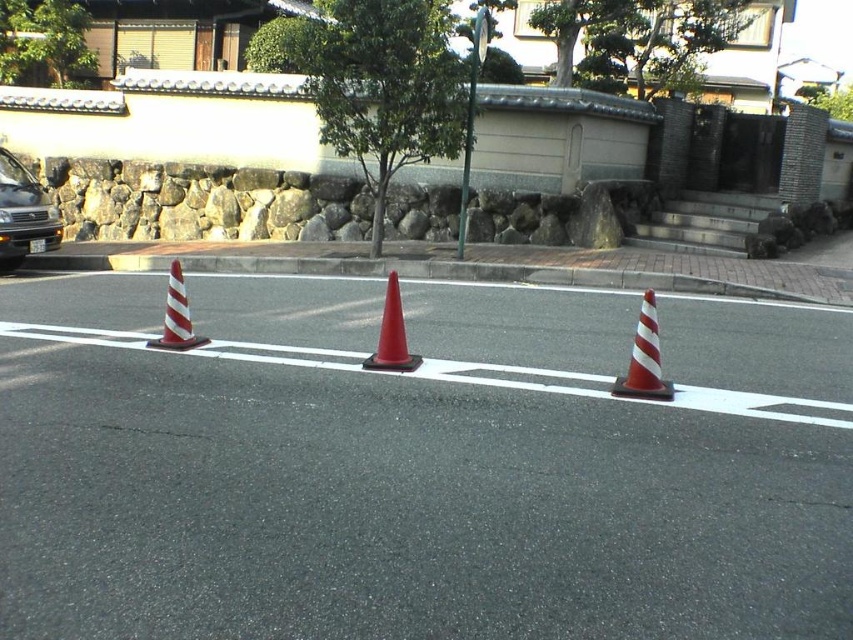
You are a delivery driver who needs to navigate around the glossy plastic traffic cone at center. What are the coordinates of the cone to avoid it?

The glossy plastic traffic cone at center is located at coordinates point (392, 333).